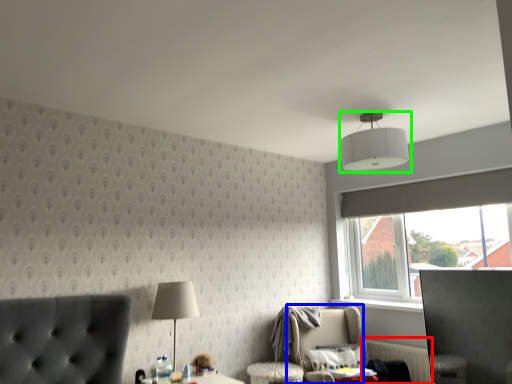
Question: Which is farther away from radiator (highlighted by a red box)? swivel chair (highlighted by a blue box) or lamp (highlighted by a green box)?

Choices:
 (A) swivel chair
 (B) lamp

Answer: (B)